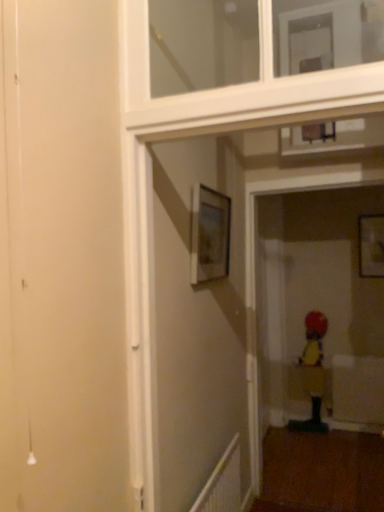
Locate an element on the screen. This screenshot has height=512, width=384. free point above yellow fabric child at lower right (from a real-world perspective) is located at coordinates (312, 305).